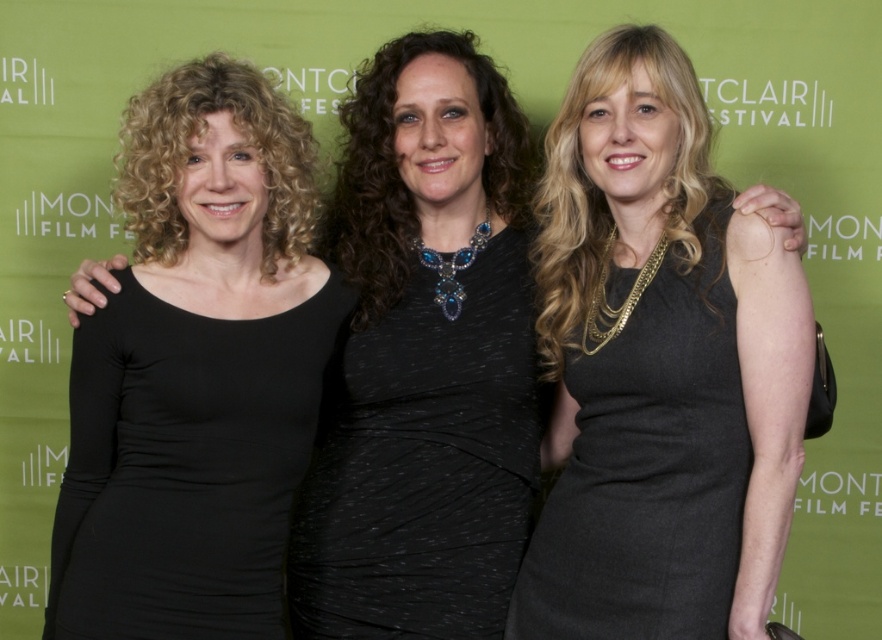
Question: Does black matte dress at center appear over black textured dress at center?

Choices:
 (A) no
 (B) yes

Answer: (A)

Question: Can you confirm if black matte dress at center is positioned to the left of black textured dress at center?

Choices:
 (A) yes
 (B) no

Answer: (A)

Question: From the image, what is the correct spatial relationship of black matte dress at center in relation to black textured dress at center?

Choices:
 (A) above
 (B) below

Answer: (B)

Question: Among these objects, which one is nearest to the camera?

Choices:
 (A) matte black dress at center
 (B) black textured dress at center

Answer: (A)

Question: Which point is closer to the camera?

Choices:
 (A) black textured dress at center
 (B) black matte dress at center
 (C) matte black dress at center

Answer: (B)

Question: Which is farther from the black textured dress at center?

Choices:
 (A) black matte dress at center
 (B) matte black dress at center

Answer: (A)